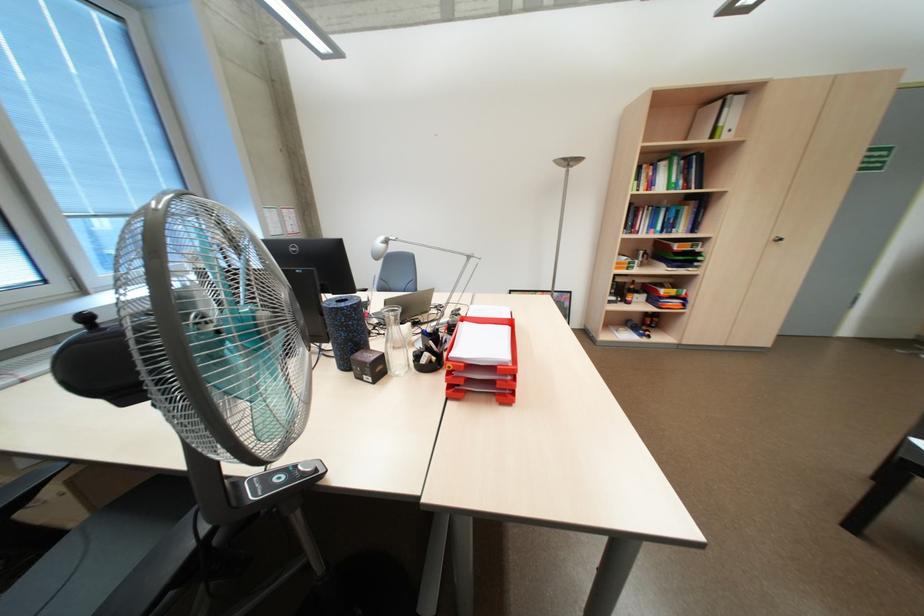
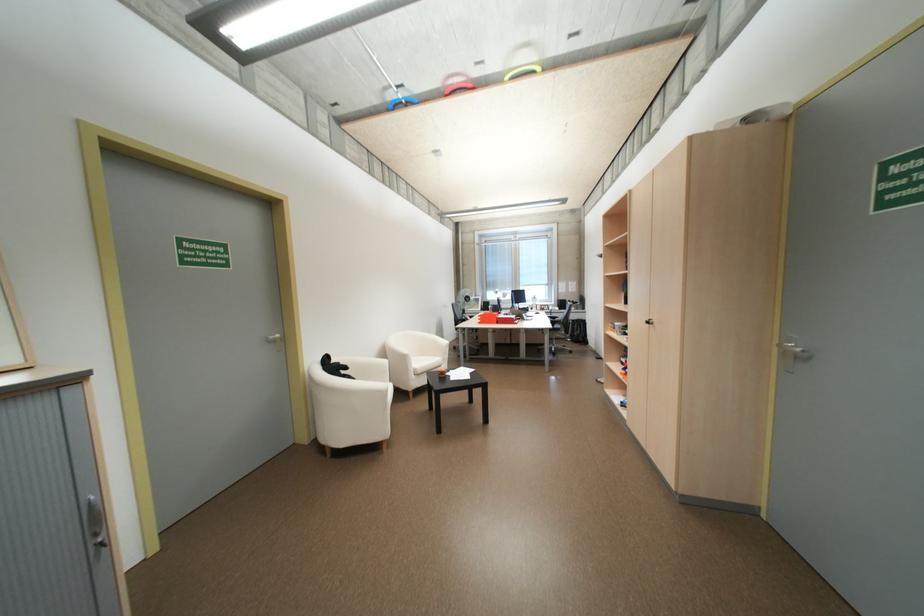
Question: I am providing you with two images of the same scene from different viewpoints. Which of the following objects are not visible in image2?

Choices:
 (A) silver door handle
 (B) black cabinet knob
 (C) brown ring binder
 (D) clear glass bottle

Answer: (D)